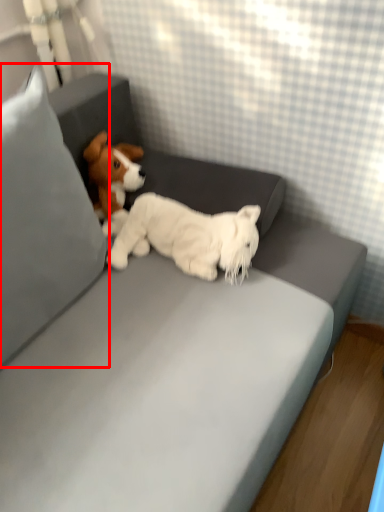
Question: From the image's perspective, where is pillow (annotated by the red box) located in relation to dog in the image?

Choices:
 (A) above
 (B) below

Answer: (A)